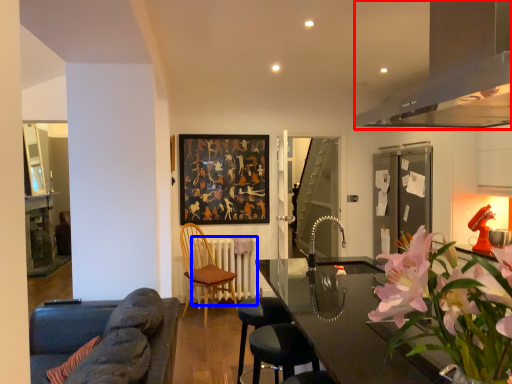
Question: Which object appears farthest to the camera in this image, exhaust hood (highlighted by a red box) or radiator (highlighted by a blue box)?

Choices:
 (A) exhaust hood
 (B) radiator

Answer: (B)